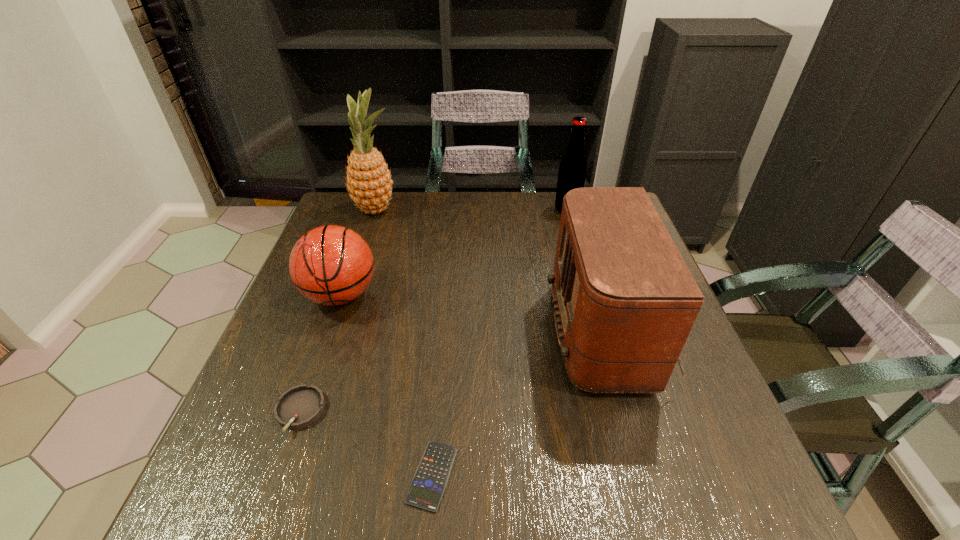
Where is `ashtray that is at the left edge`? This screenshot has height=540, width=960. ashtray that is at the left edge is located at coordinates (300, 406).

Find the location of a particular element. This screenshot has width=960, height=540. beer bottle positioned at the right edge is located at coordinates (572, 169).

In order to click on radio receiver at the right edge in this screenshot , I will do `click(625, 301)`.

In order to click on object present at the far left corner in this screenshot , I will do `click(369, 181)`.

Locate an element on the screen. The image size is (960, 540). object that is at the far right corner is located at coordinates (572, 169).

You are a GUI agent. You are given a task and a screenshot of the screen. Output one action in this format:
    pyautogui.click(x=<x>, y=<y>)
    Task: Click on the free space at the far edge of the desktop
    This screenshot has height=540, width=960.
    Given the screenshot: What is the action you would take?
    pyautogui.click(x=518, y=225)

At what (x,y) coordinates should I click in order to perform the action: click on vacant space at the near edge of the desktop. Please return your answer as a coordinate pair (x, y). This screenshot has width=960, height=540. Looking at the image, I should click on (638, 489).

I want to click on vacant space at the left edge, so click(x=331, y=312).

This screenshot has height=540, width=960. In the image, there is a desktop. Identify the location of free space at the right edge. (671, 381).

At what (x,y) coordinates should I click in order to perform the action: click on vacant space at the near left corner. Please return your answer as a coordinate pair (x, y). This screenshot has width=960, height=540. Looking at the image, I should click on (204, 487).